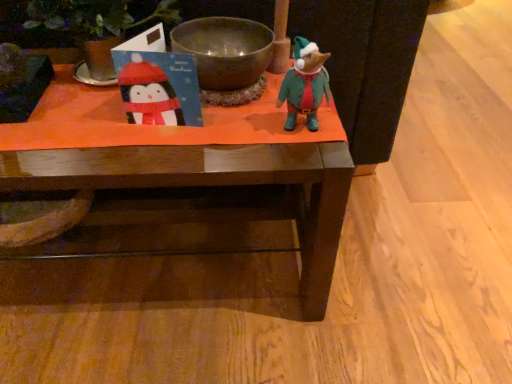
Question: Considering the relative sizes of shiny metallic bowl at center and green felt mouse at center in the image provided, is shiny metallic bowl at center bigger than green felt mouse at center?

Choices:
 (A) yes
 (B) no

Answer: (A)

Question: Considering the relative sizes of shiny metallic bowl at center and green felt mouse at center in the image provided, is shiny metallic bowl at center taller than green felt mouse at center?

Choices:
 (A) no
 (B) yes

Answer: (A)

Question: Can you confirm if shiny metallic bowl at center is shorter than green felt mouse at center?

Choices:
 (A) yes
 (B) no

Answer: (A)

Question: Considering the relative positions of shiny metallic bowl at center and green felt mouse at center in the image provided, is shiny metallic bowl at center to the right of green felt mouse at center from the viewer's perspective?

Choices:
 (A) no
 (B) yes

Answer: (A)

Question: Considering the relative positions of shiny metallic bowl at center and green felt mouse at center in the image provided, is shiny metallic bowl at center to the left of green felt mouse at center from the viewer's perspective?

Choices:
 (A) no
 (B) yes

Answer: (B)

Question: In the image, is shiny metallic bowl at center positioned in front of or behind green felt mouse at center?

Choices:
 (A) front
 (B) behind

Answer: (B)

Question: Based on their sizes in the image, would you say shiny metallic bowl at center is bigger or smaller than green felt mouse at center?

Choices:
 (A) small
 (B) big

Answer: (B)

Question: Considering the positions of shiny metallic bowl at center and green felt mouse at center in the image, is shiny metallic bowl at center taller or shorter than green felt mouse at center?

Choices:
 (A) tall
 (B) short

Answer: (B)

Question: In the image, is shiny metallic bowl at center on the left side or the right side of green felt mouse at center?

Choices:
 (A) right
 (B) left

Answer: (B)

Question: In the image, is green felt mouse at center on the left side or the right side of wooden table at center?

Choices:
 (A) left
 (B) right

Answer: (B)

Question: Does point (309, 51) appear closer or farther from the camera than point (68, 71)?

Choices:
 (A) farther
 (B) closer

Answer: (B)

Question: Considering the positions of green felt mouse at center and wooden table at center in the image, is green felt mouse at center bigger or smaller than wooden table at center?

Choices:
 (A) small
 (B) big

Answer: (A)

Question: In terms of width, does green felt mouse at center look wider or thinner when compared to wooden table at center?

Choices:
 (A) thin
 (B) wide

Answer: (A)

Question: Looking at the image, does wooden table at center seem bigger or smaller compared to green felt mouse at center?

Choices:
 (A) big
 (B) small

Answer: (A)

Question: From a real-world perspective, is wooden table at center above or below green felt mouse at center?

Choices:
 (A) below
 (B) above

Answer: (A)